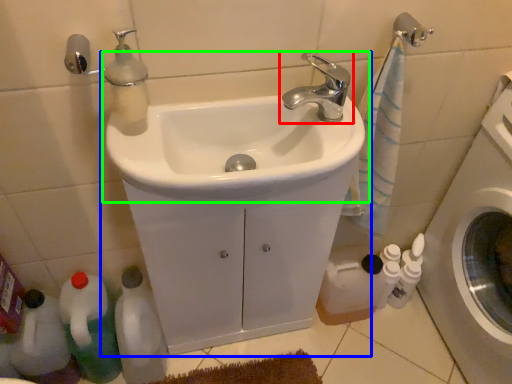
Question: Estimate the real-world distances between objects in this image. Which object is closer to tap (highlighted by a red box), sink (highlighted by a blue box) or sink (highlighted by a green box)?

Choices:
 (A) sink
 (B) sink

Answer: (B)